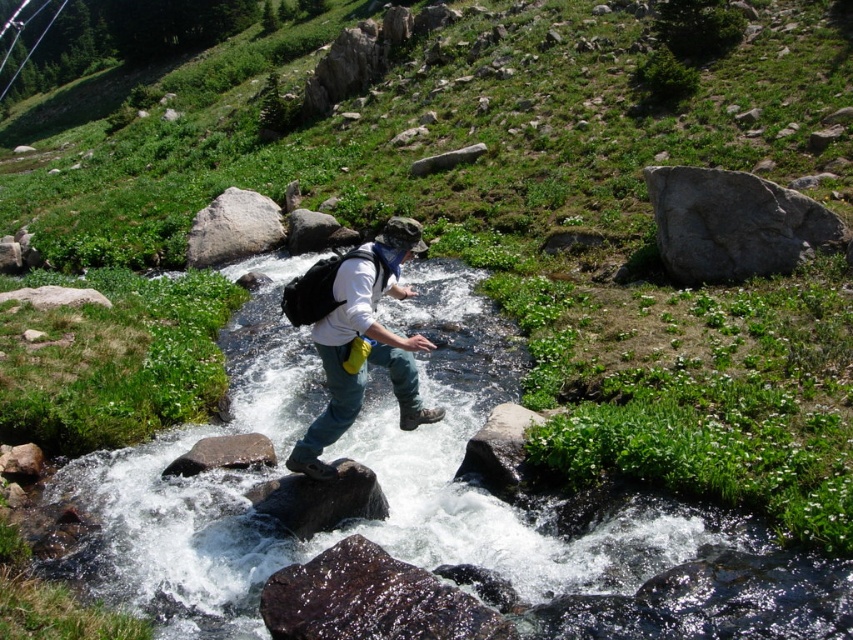
Looking at this image, does shiny dark rock at center have a lesser height compared to smooth gray rock at center?

No.

Can you confirm if shiny dark rock at center is bigger than smooth gray rock at center?

Indeed, shiny dark rock at center has a larger size compared to smooth gray rock at center.

Which is in front, point (283, 628) or point (231, 461)?

Point (283, 628) is in front.

The width and height of the screenshot is (853, 640). In order to click on shiny dark rock at center in this screenshot , I will do `click(370, 600)`.

Is clear water at center smaller than gray rough rock at upper right?

No.

Which of these two, clear water at center or gray rough rock at upper right, stands taller?

With more height is clear water at center.

Does point (338, 442) lie behind point (717, 282)?

No, (338, 442) is in front of (717, 282).

The height and width of the screenshot is (640, 853). I want to click on clear water at center, so click(x=361, y=461).

Based on the photo, who is more forward, (697, 278) or (207, 464)?

Positioned in front is point (207, 464).

Which of these two, gray rough rock at upper right or smooth gray rock at center, stands taller?

With more height is gray rough rock at upper right.

Who is more distant from viewer, (833, 243) or (215, 451)?

Point (833, 243)

Image resolution: width=853 pixels, height=640 pixels. In order to click on gray rough rock at upper right in this screenshot , I will do `click(734, 225)`.